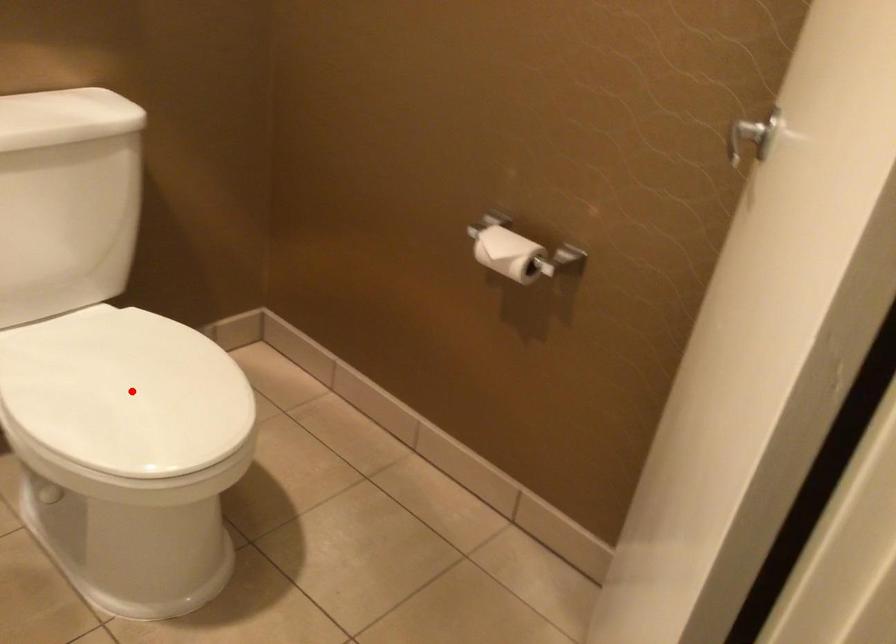
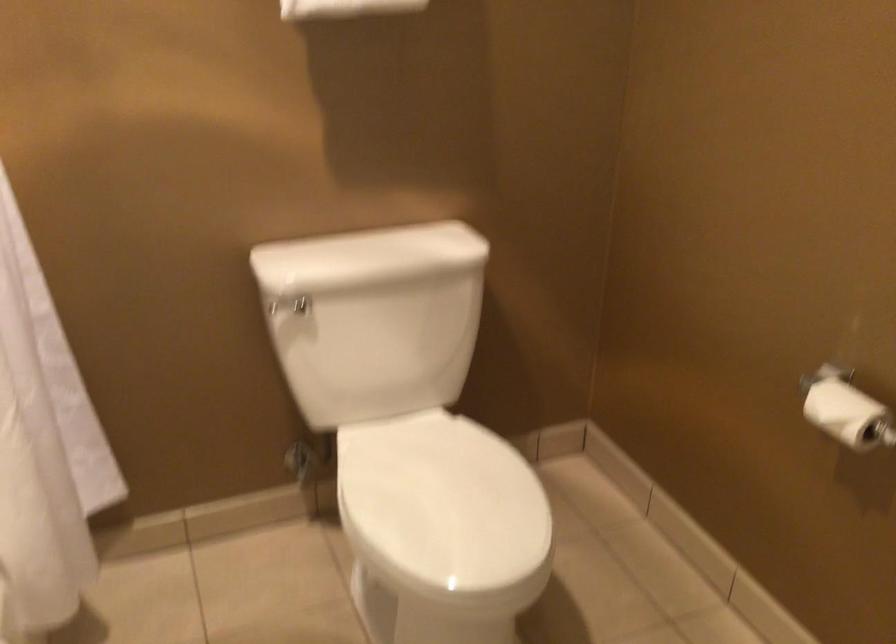
Find the pixel in the second image that matches the highlighted location in the first image.

(442, 505)